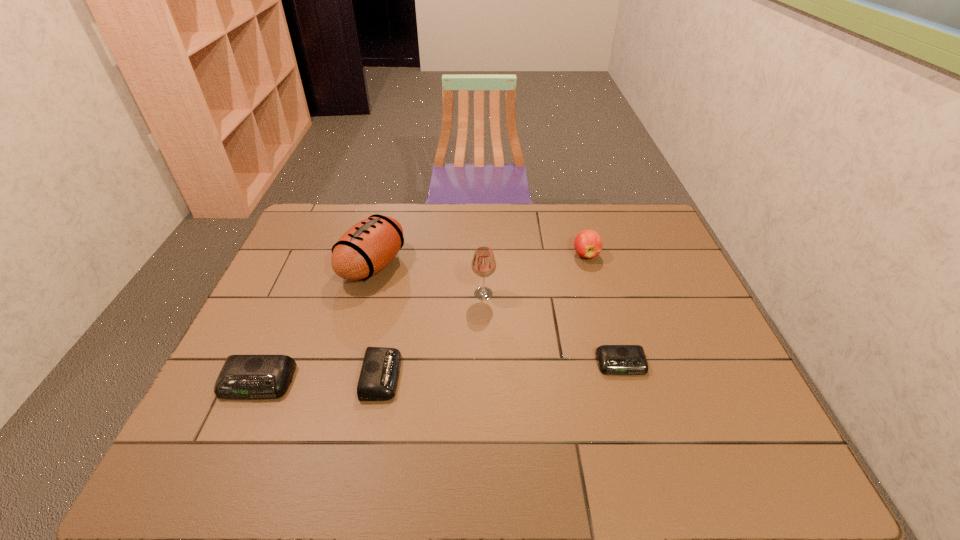
Locate an element on the screen. vacant point at the right edge is located at coordinates (688, 279).

Identify the location of free space at the far left corner of the desktop. (305, 241).

In the image, there is a desktop. Identify the location of free space at the near left corner. The width and height of the screenshot is (960, 540). (232, 408).

Where is `vacant space at the far right corner of the desktop`? vacant space at the far right corner of the desktop is located at coordinates (642, 214).

Locate an element on the screen. vacant space at the near right corner of the desktop is located at coordinates (731, 402).

The width and height of the screenshot is (960, 540). I want to click on free area in between the fourth object from left to right and the second alarm clock from left to right, so click(433, 335).

The image size is (960, 540). Identify the location of free space between the wineglass and the second alarm clock from left to right. (433, 335).

Identify the location of vacant area between the leftmost object and the fourth shortest object. This screenshot has width=960, height=540. (421, 318).

At what (x,y) coordinates should I click in order to perform the action: click on vacant area that lies between the football (American) and the wineglass. Please return your answer as a coordinate pair (x, y). Looking at the image, I should click on (428, 280).

Locate an element on the screen. The width and height of the screenshot is (960, 540). vacant space that's between the football (American) and the fourth object from left to right is located at coordinates coord(428,280).